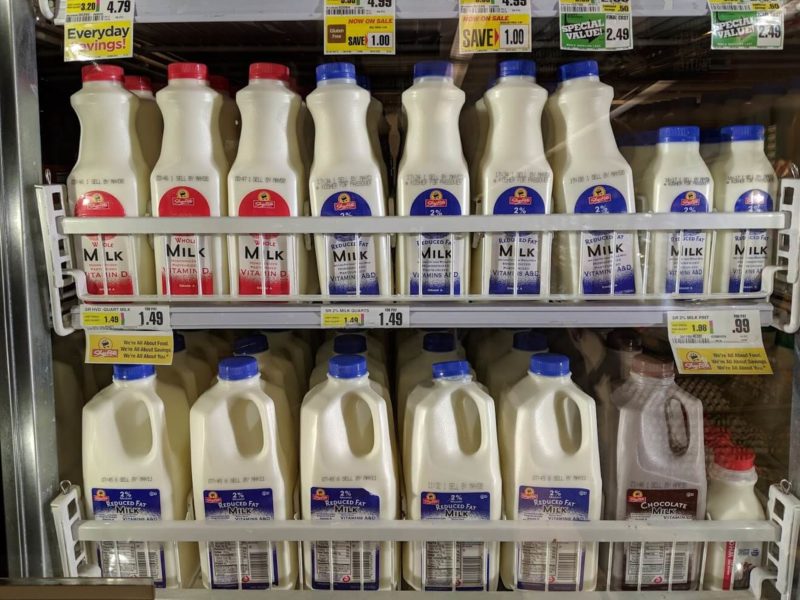
Identify the location of shelf tags. This screenshot has height=600, width=800. (94, 12), (365, 21), (492, 19), (580, 18), (725, 30), (129, 321), (365, 324), (718, 337).